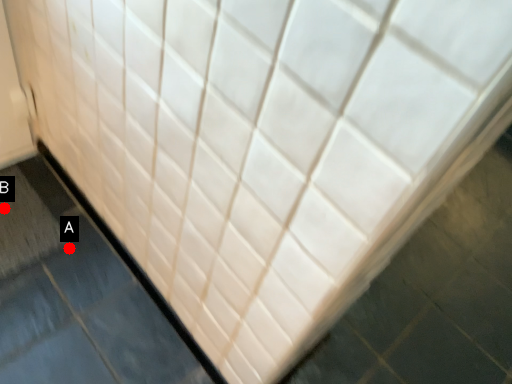
Question: Two points are circled on the image, labeled by A and B beside each circle. Which point appears farthest from the camera in this image?

Choices:
 (A) A is further
 (B) B is further

Answer: (B)